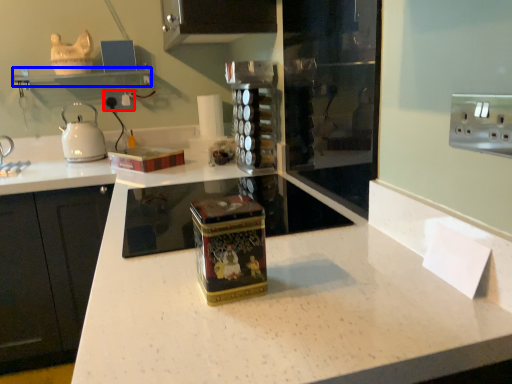
Question: Which object appears closest to the camera in this image, electric outlet (highlighted by a red box) or shelf (highlighted by a blue box)?

Choices:
 (A) electric outlet
 (B) shelf

Answer: (B)